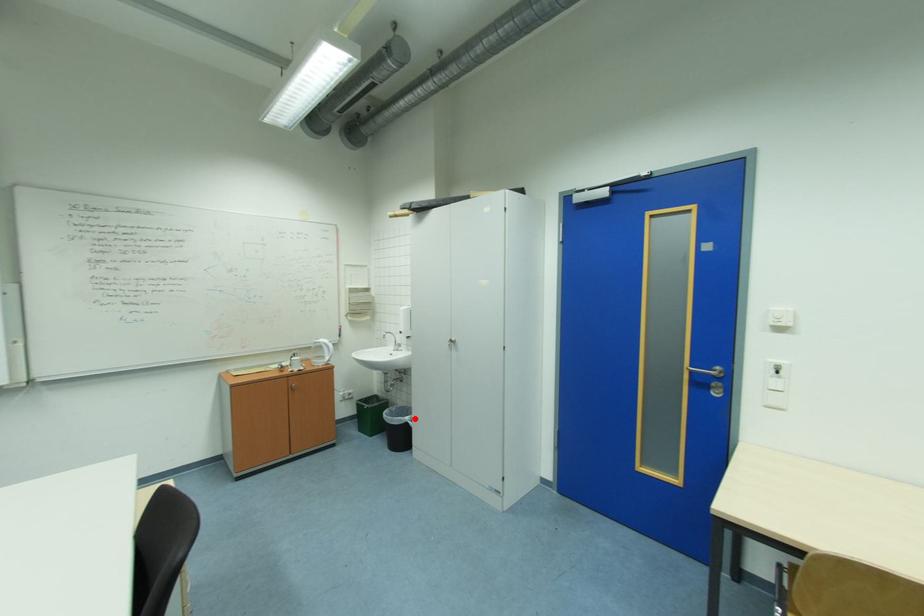
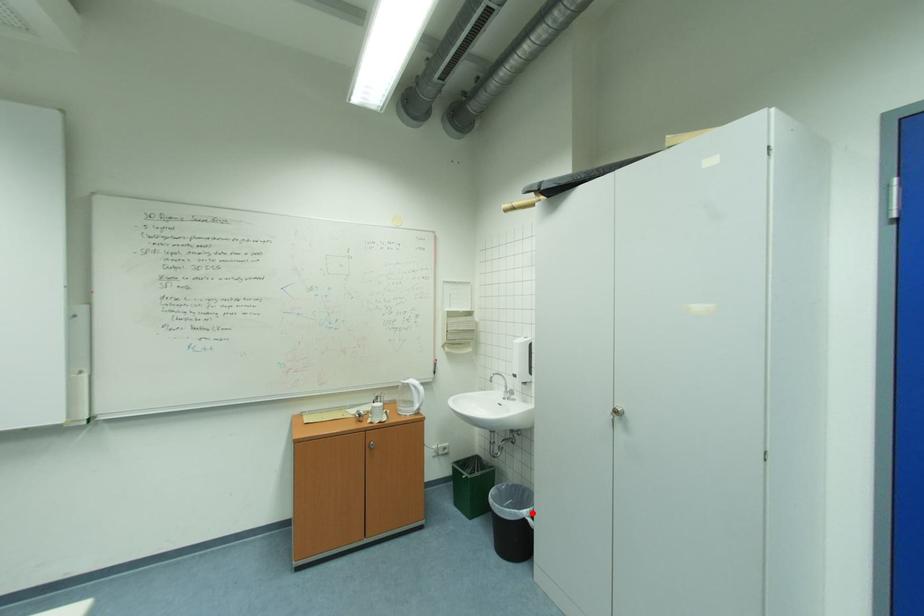
I am providing you with two images of the same scene from different viewpoints. A red point is marked on the first image and another point is marked on the second image. Does the point marked in image1 correspond to the same location as the one in image2?

Yes